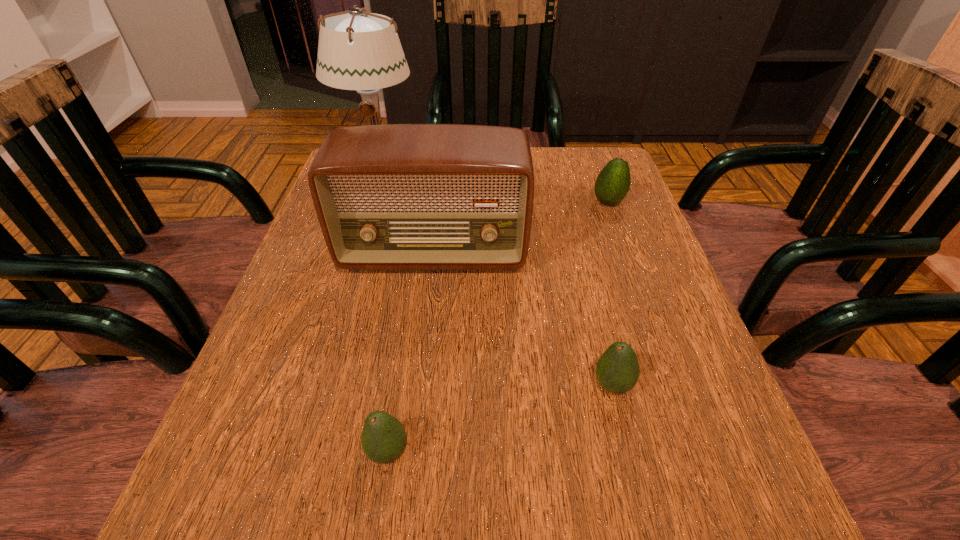
Identify the location of free space that satisfies the following two spatial constraints: 1. on the lampshade of the rightmost avocado; 2. on the left side of the tallest object. [370, 202].

The width and height of the screenshot is (960, 540). Identify the location of vacant region that satisfies the following two spatial constraints: 1. on the front-facing side of the third nearest object; 2. on the right side of the second avocado from left to right. (419, 385).

You are a GUI agent. You are given a task and a screenshot of the screen. Output one action in this format:
    pyautogui.click(x=<x>, y=<y>)
    Task: Click on the free space that satisfies the following two spatial constraints: 1. on the front-facing side of the fourth shortest object; 2. on the left side of the fourth farthest object
    
    Given the screenshot: What is the action you would take?
    pyautogui.click(x=419, y=385)

Find the location of a particular element. This screenshot has height=540, width=960. vacant space that satisfies the following two spatial constraints: 1. on the lampshade of the second object from right to left; 2. on the right side of the farthest object is located at coordinates (312, 385).